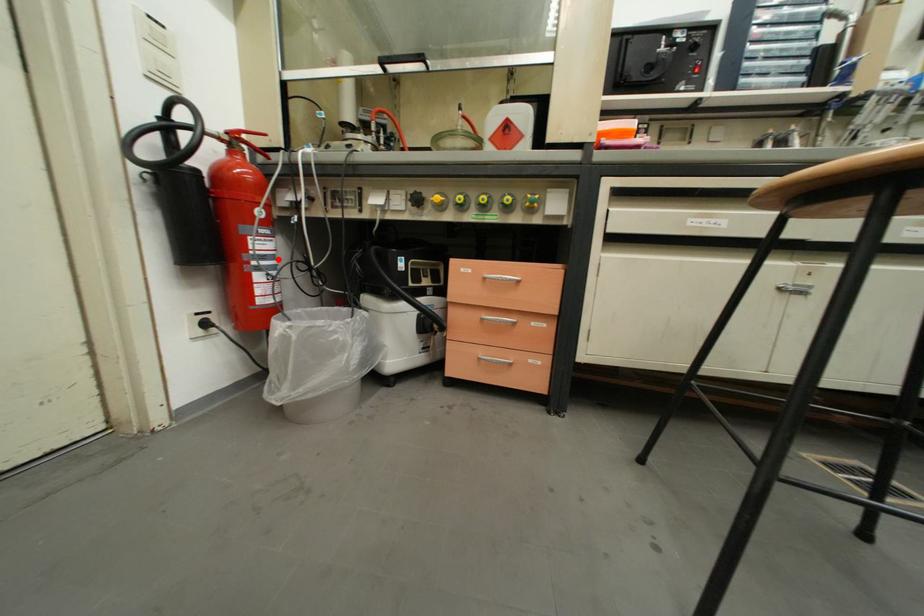
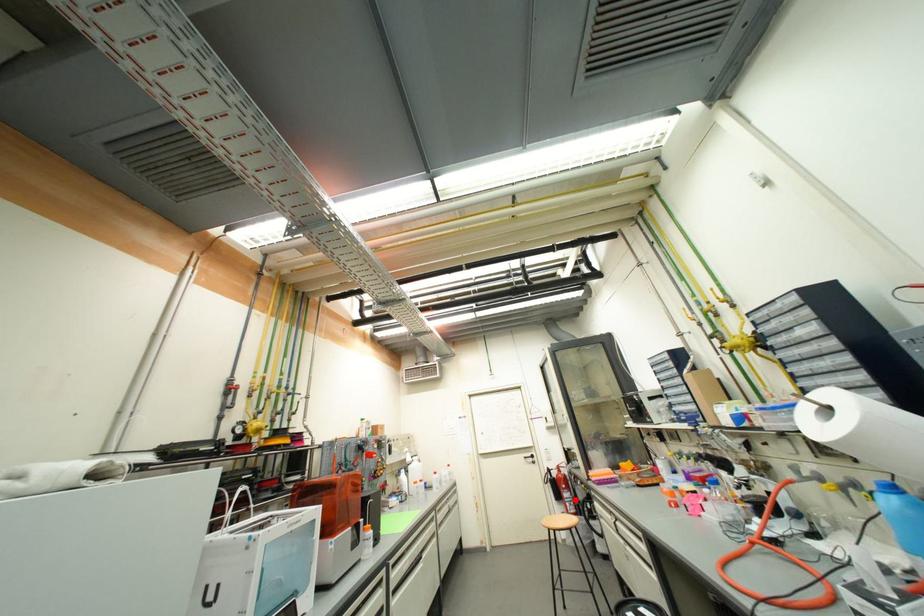
I am providing you with two images of the same scene from different viewpoints. A red point is marked on the first image and another point is marked on the second image. Is the red point in image1 aligned with the point shown in image2?

Yes